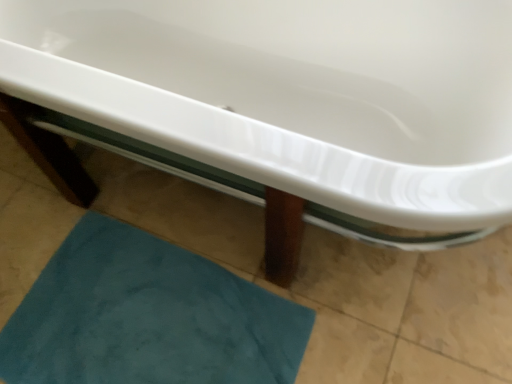
You are a GUI agent. You are given a task and a screenshot of the screen. Output one action in this format:
    pyautogui.click(x=<x>, y=<y>)
    Task: Click on the teal plush bath mat at lower left
    The width and height of the screenshot is (512, 384).
    Given the screenshot: What is the action you would take?
    pyautogui.click(x=147, y=317)

What do you see at coordinates (147, 317) in the screenshot? This screenshot has width=512, height=384. I see `teal plush bath mat at lower left` at bounding box center [147, 317].

What is the approximate height of white glossy bathtub at center?

69.01 centimeters.

Describe the element at coordinates (289, 101) in the screenshot. I see `white glossy bathtub at center` at that location.

You are a GUI agent. You are given a task and a screenshot of the screen. Output one action in this format:
    pyautogui.click(x=<x>, y=<y>)
    Task: Click on the white glossy bathtub at center
    
    Given the screenshot: What is the action you would take?
    pyautogui.click(x=289, y=101)

Where is `teal plush bath mat at lower left`? The image size is (512, 384). teal plush bath mat at lower left is located at coordinates (147, 317).

Considering the positions of objects teal plush bath mat at lower left and white glossy bathtub at center in the image provided, who is more to the left, teal plush bath mat at lower left or white glossy bathtub at center?

teal plush bath mat at lower left.

Is teal plush bath mat at lower left in front of or behind white glossy bathtub at center in the image?

teal plush bath mat at lower left is positioned farther from the viewer than white glossy bathtub at center.

Is point (293, 334) positioned behind point (174, 39)?

No, it is not.

From the image's perspective, is teal plush bath mat at lower left located beneath white glossy bathtub at center?

Yes, from the image's perspective, teal plush bath mat at lower left is beneath white glossy bathtub at center.

From a real-world perspective, is teal plush bath mat at lower left located beneath white glossy bathtub at center?

Yes, from a real-world perspective, teal plush bath mat at lower left is under white glossy bathtub at center.

Is teal plush bath mat at lower left wider than white glossy bathtub at center?

No, teal plush bath mat at lower left is not wider than white glossy bathtub at center.

Considering the sizes of objects teal plush bath mat at lower left and white glossy bathtub at center in the image provided, who is shorter, teal plush bath mat at lower left or white glossy bathtub at center?

teal plush bath mat at lower left.

Considering the relative sizes of teal plush bath mat at lower left and white glossy bathtub at center in the image provided, is teal plush bath mat at lower left smaller than white glossy bathtub at center?

Yes.

Is teal plush bath mat at lower left spatially inside white glossy bathtub at center, or outside of it?

teal plush bath mat at lower left lies outside white glossy bathtub at center.

Is teal plush bath mat at lower left next to white glossy bathtub at center?

No, teal plush bath mat at lower left is not touching white glossy bathtub at center.

Is teal plush bath mat at lower left facing away from white glossy bathtub at center?

Yes, teal plush bath mat at lower left is facing away from white glossy bathtub at center.

How different are the orientations of teal plush bath mat at lower left and white glossy bathtub at center in degrees?

The angle between the facing direction of teal plush bath mat at lower left and the facing direction of white glossy bathtub at center is 3.5 degrees.

Locate an element on the screen. bathtub in front of the teal plush bath mat at lower left is located at coordinates (289, 101).

Can you confirm if white glossy bathtub at center is positioned to the right of teal plush bath mat at lower left?

Correct, you'll find white glossy bathtub at center to the right of teal plush bath mat at lower left.

From the picture: Considering the relative positions of white glossy bathtub at center and teal plush bath mat at lower left in the image provided, is white glossy bathtub at center behind teal plush bath mat at lower left?

No, white glossy bathtub at center is closer to the camera.

Is point (143, 56) more distant than point (176, 337)?

Yes, point (143, 56) is farther from viewer.

From the image's perspective, which object appears higher, white glossy bathtub at center or teal plush bath mat at lower left?

white glossy bathtub at center.

From a real-world perspective, is white glossy bathtub at center on teal plush bath mat at lower left?

Indeed, from a real-world perspective, white glossy bathtub at center stands above teal plush bath mat at lower left.

Which of these two, white glossy bathtub at center or teal plush bath mat at lower left, is thinner?

Thinner between the two is teal plush bath mat at lower left.

Does white glossy bathtub at center have a lesser height compared to teal plush bath mat at lower left?

In fact, white glossy bathtub at center may be taller than teal plush bath mat at lower left.

Does white glossy bathtub at center have a larger size compared to teal plush bath mat at lower left?

Correct, white glossy bathtub at center is larger in size than teal plush bath mat at lower left.

Is teal plush bath mat at lower left surrounded by white glossy bathtub at center?

Definitely not — teal plush bath mat at lower left is not inside white glossy bathtub at center.

Is white glossy bathtub at center far from teal plush bath mat at lower left?

No.

Is white glossy bathtub at center facing away from teal plush bath mat at lower left?

No, white glossy bathtub at center is not facing away from teal plush bath mat at lower left.

What's the angular difference between white glossy bathtub at center and teal plush bath mat at lower left's facing directions?

There is a 3.5-degree angle between the facing directions of white glossy bathtub at center and teal plush bath mat at lower left.

I want to click on bathtub on the right of teal plush bath mat at lower left, so click(x=289, y=101).

You are a GUI agent. You are given a task and a screenshot of the screen. Output one action in this format:
    pyautogui.click(x=<x>, y=<y>)
    Task: Click on the bathtub that appears above the teal plush bath mat at lower left (from a real-world perspective)
    The height and width of the screenshot is (384, 512).
    Given the screenshot: What is the action you would take?
    pyautogui.click(x=289, y=101)

The height and width of the screenshot is (384, 512). I want to click on bathtub on the right of teal plush bath mat at lower left, so click(x=289, y=101).